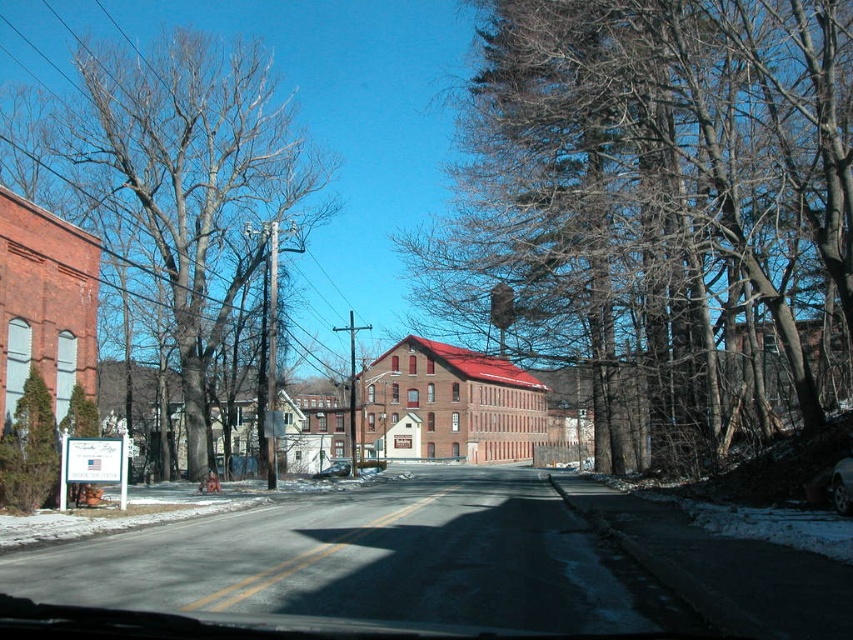
Where is `shiny black car at center`? shiny black car at center is located at coordinates (840, 484).

This screenshot has width=853, height=640. Identify the location of shiny black car at center. (840, 484).

How far apart are bare branches at right and shiny black sedan at center?

21.54 meters

Between bare branches at right and shiny black sedan at center, which one has more height?

Standing taller between the two is bare branches at right.

You are a GUI agent. You are given a task and a screenshot of the screen. Output one action in this format:
    pyautogui.click(x=<x>, y=<y>)
    Task: Click on the bare branches at right
    
    Given the screenshot: What is the action you would take?
    pyautogui.click(x=654, y=198)

Looking at this image, is bare branches at right closer to the viewer compared to brown bark tree at left?

Yes, it is.

Which is in front, point (538, 193) or point (238, 276)?

Point (538, 193) is more forward.

This screenshot has height=640, width=853. Identify the location of bare branches at right. (654, 198).